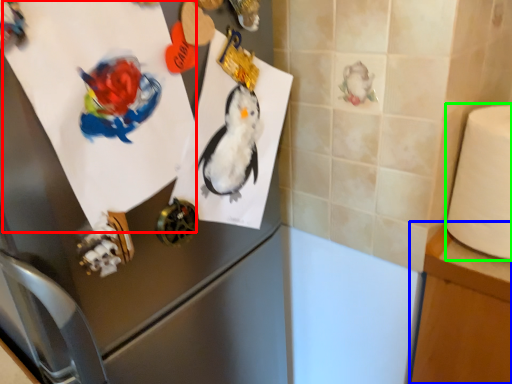
Question: Which object is positioned closest to paper (highlighted by a red box)? Select from table (highlighted by a blue box) and toilet paper (highlighted by a green box).

Choices:
 (A) table
 (B) toilet paper

Answer: (B)